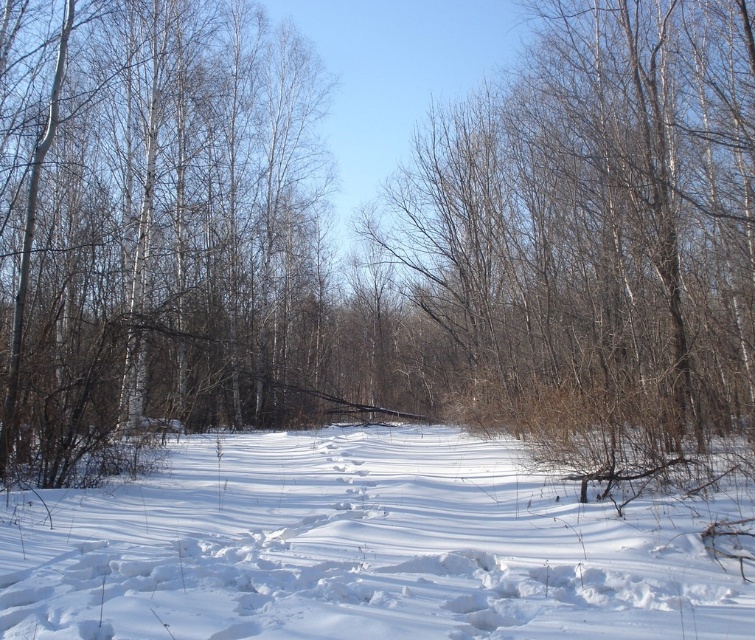
Who is shorter, bare branches at center or white fluffy snow at center?

With less height is white fluffy snow at center.

What do you see at coordinates (596, 236) in the screenshot? The height and width of the screenshot is (640, 755). I see `bare branches at center` at bounding box center [596, 236].

Where is `bare branches at center`? The width and height of the screenshot is (755, 640). bare branches at center is located at coordinates coord(596,236).

Can you confirm if bare branches at center is positioned below white bark tree at center?

No, bare branches at center is not below white bark tree at center.

Does point (609, 236) lie behind point (22, 408)?

That is True.

This screenshot has width=755, height=640. Identify the location of bare branches at center. (596, 236).

Can you confirm if white bark tree at center is positioned above white fluffy snow at center?

Yes, white bark tree at center is above white fluffy snow at center.

Is white bark tree at center smaller than white fluffy snow at center?

Actually, white bark tree at center might be larger than white fluffy snow at center.

Which is behind, point (17, 378) or point (535, 492)?

The point (17, 378) is more distant.

You are a GUI agent. You are given a task and a screenshot of the screen. Output one action in this format:
    pyautogui.click(x=<x>, y=<y>)
    Task: Click on the white bark tree at center
    The width and height of the screenshot is (755, 640).
    Given the screenshot: What is the action you would take?
    pyautogui.click(x=159, y=228)